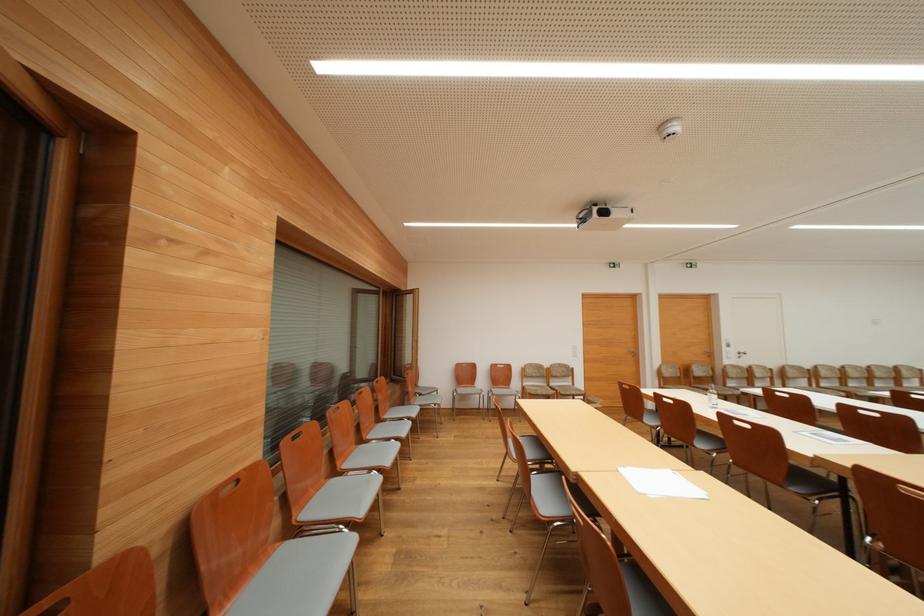
Locate an element on the screen. chair armrest is located at coordinates (263, 554).